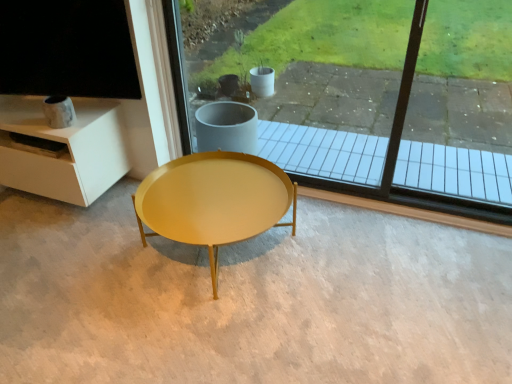
Find the location of a particular element. This screenshot has width=512, height=384. vacant space in matte yellow table at center (from a real-world perspective) is located at coordinates (216, 258).